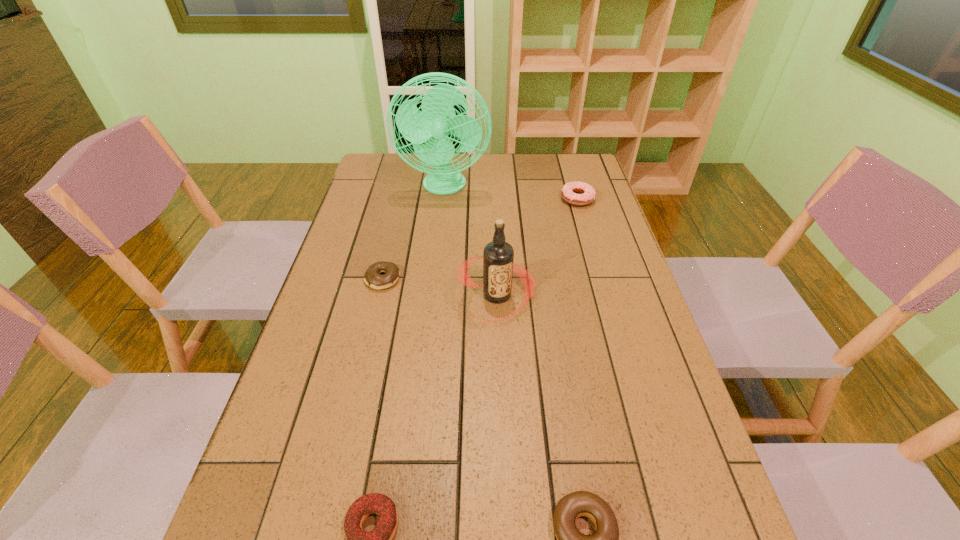
I want to click on fan, so click(437, 119).

Where is `the fifth shortest object`? the fifth shortest object is located at coordinates (498, 256).

Identify the location of the farthest doughnut. This screenshot has width=960, height=540. (578, 193).

This screenshot has width=960, height=540. I want to click on the rightmost doughnut, so click(x=578, y=193).

Find the location of a particular element. This screenshot has width=960, height=540. the third nearest doughnut is located at coordinates (372, 278).

The image size is (960, 540). Identify the location of free point located 0.120m in front of the fan to blow air. (441, 224).

Where is `vacant area situated 0.070m on the label of the root beer`? vacant area situated 0.070m on the label of the root beer is located at coordinates (499, 348).

Image resolution: width=960 pixels, height=540 pixels. In order to click on vacant space situated 0.090m on the back of the farthest doughnut in this screenshot , I will do `click(571, 177)`.

This screenshot has width=960, height=540. I want to click on vacant area situated 0.270m on the right of the third nearest doughnut, so click(497, 279).

Locate an element on the screen. Image resolution: width=960 pixels, height=540 pixels. object at the far edge is located at coordinates (437, 119).